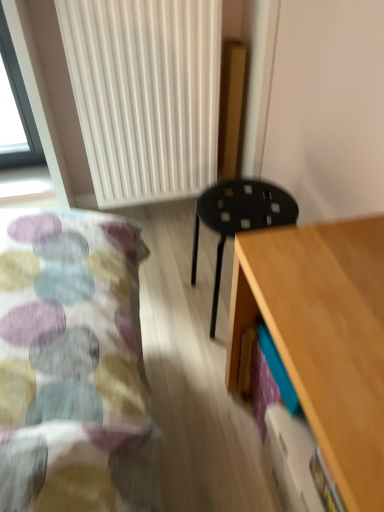
The image size is (384, 512). I want to click on vacant area on top of black plastic stool at center (from a real-world perspective), so click(243, 203).